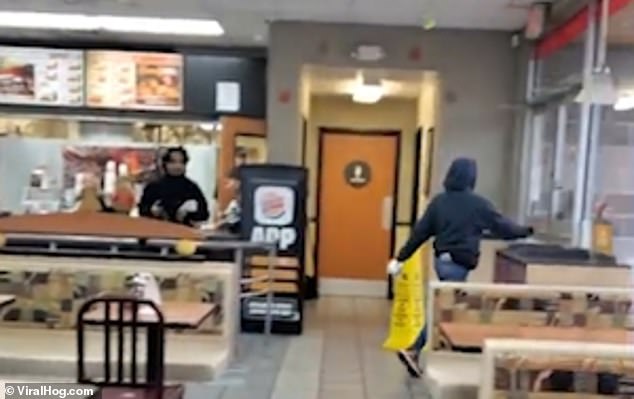
Where is `light source`? light source is located at coordinates (368, 90), (129, 24), (47, 22).